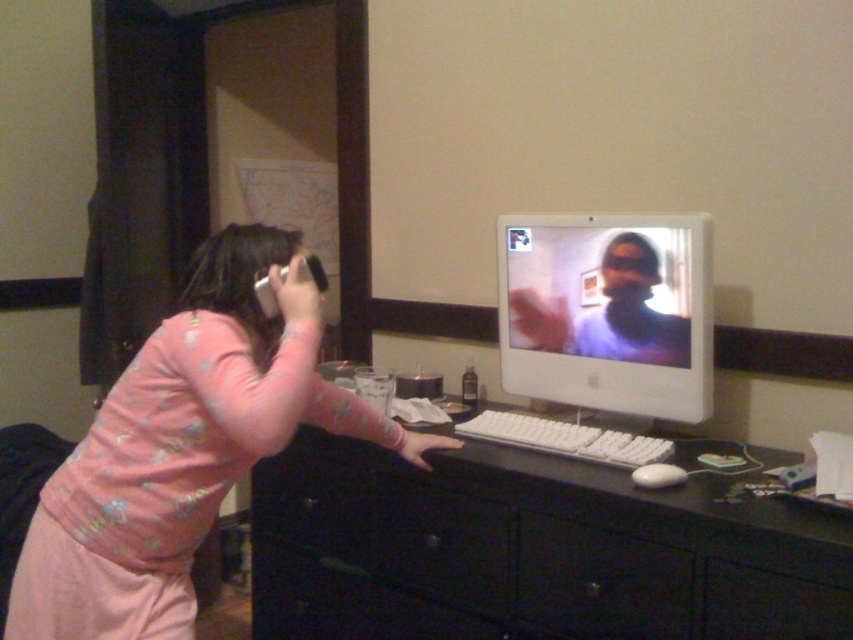
Can you confirm if pink fabric at left is positioned below white glossy monitor at center?

Yes.

What do you see at coordinates (184, 448) in the screenshot? I see `pink fabric at left` at bounding box center [184, 448].

Between point (169, 454) and point (648, 358), which one is positioned in front?

Point (169, 454) is in front.

Where is `pink fabric at left`? Image resolution: width=853 pixels, height=640 pixels. pink fabric at left is located at coordinates (184, 448).

Does pink fabric at left appear under white plastic keyboard at center?

Yes, pink fabric at left is below white plastic keyboard at center.

What do you see at coordinates (184, 448) in the screenshot? Image resolution: width=853 pixels, height=640 pixels. I see `pink fabric at left` at bounding box center [184, 448].

Is point (277, 428) positioned after point (618, 465)?

No, (277, 428) is closer to viewer.

Identify the location of pink fabric at left. (184, 448).

Between pink fabric at left and black plastic drawer at lower center, which one appears on the right side from the viewer's perspective?

Positioned to the right is black plastic drawer at lower center.

Is point (281, 282) closer to viewer compared to point (550, 593)?

Yes, point (281, 282) is in front of point (550, 593).

Does point (225, 232) lie behind point (579, 620)?

No, it is in front of (579, 620).

Where is `pink fabric at left`? The height and width of the screenshot is (640, 853). pink fabric at left is located at coordinates (184, 448).